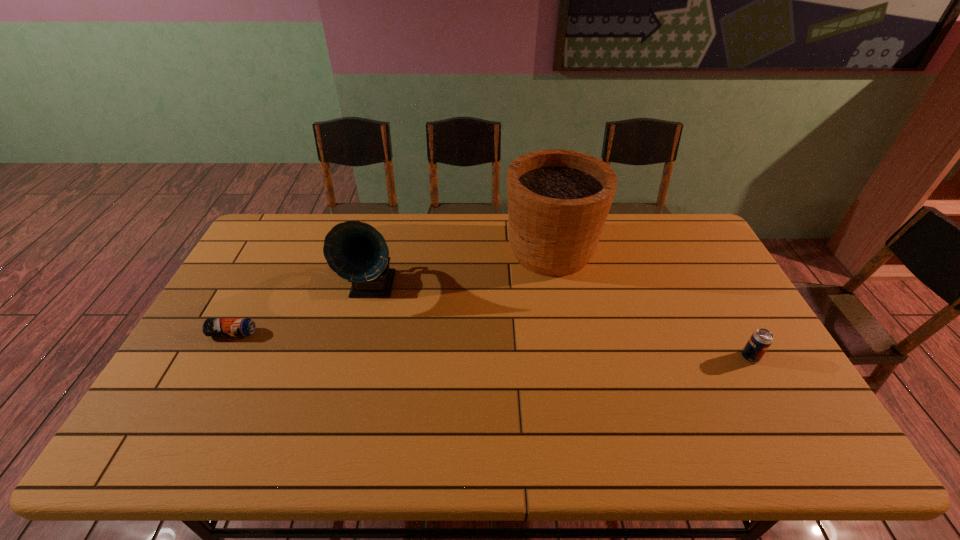
Find the location of a particular element. free space between the phonograph_record and the third object from left to right is located at coordinates (462, 269).

Where is `blank region between the shorter beer can and the flowerpot`? The height and width of the screenshot is (540, 960). blank region between the shorter beer can and the flowerpot is located at coordinates (392, 292).

Where is `empty space that is in between the third object from left to right and the shortest object`? Image resolution: width=960 pixels, height=540 pixels. empty space that is in between the third object from left to right and the shortest object is located at coordinates (392, 292).

At what (x,y) coordinates should I click in order to perform the action: click on free space between the shorter beer can and the third object from right to left. Please return your answer as a coordinate pair (x, y). Looking at the image, I should click on (302, 310).

Locate an element on the screen. free space between the second object from right to left and the right beer can is located at coordinates (651, 304).

Where is `free space between the rightmost object and the third farthest object`? This screenshot has height=540, width=960. free space between the rightmost object and the third farthest object is located at coordinates (492, 345).

Identify the location of free space between the shortest object and the second object from right to left. (392, 292).

Choose which object is the third nearest neighbor to the third object from left to right. Please provide its 2D coordinates. Your answer should be formatted as a tuple, i.e. [(x, y)], where the tuple contains the x and y coordinates of a point satisfying the conditions above.

[(212, 326)]

Identify which object is the nearest to the third object from right to left. Please provide its 2D coordinates. Your answer should be formatted as a tuple, i.e. [(x, y)], where the tuple contains the x and y coordinates of a point satisfying the conditions above.

[(212, 326)]

Identify the location of vacant position in the image that satisfies the following two spatial constraints: 1. on the front side of the left beer can; 2. on the right side of the taller beer can. This screenshot has width=960, height=540. (220, 357).